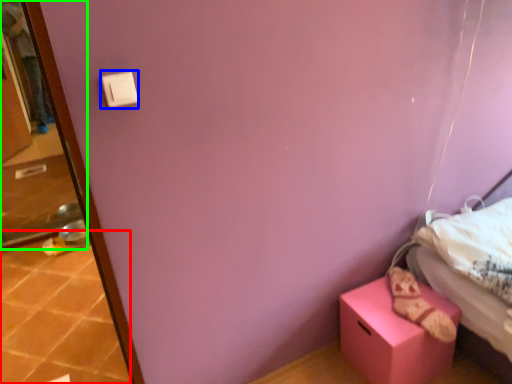
Question: Considering the real-world distances, which object is farthest from tile (highlighted by a red box)? light switch (highlighted by a blue box) or screen door (highlighted by a green box)?

Choices:
 (A) light switch
 (B) screen door

Answer: (A)